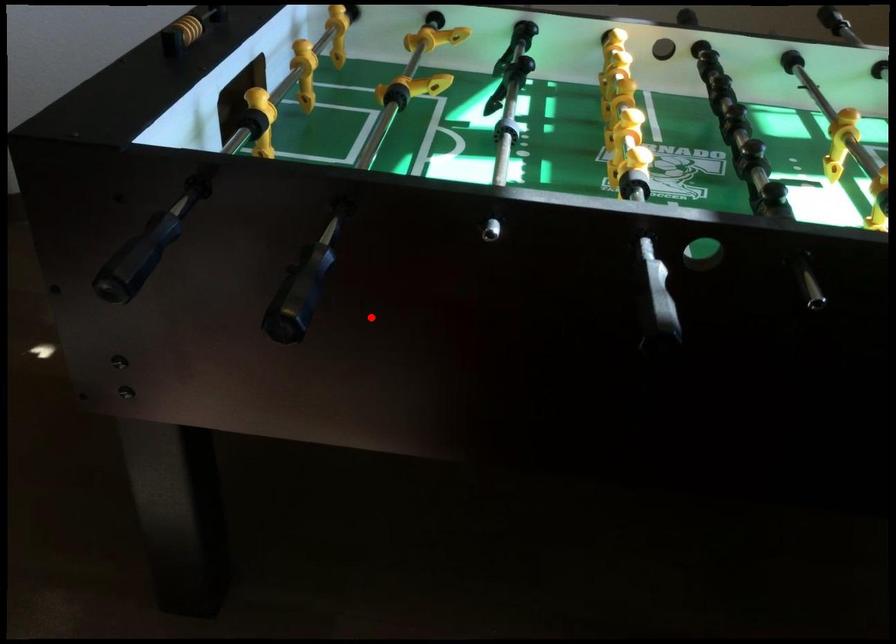
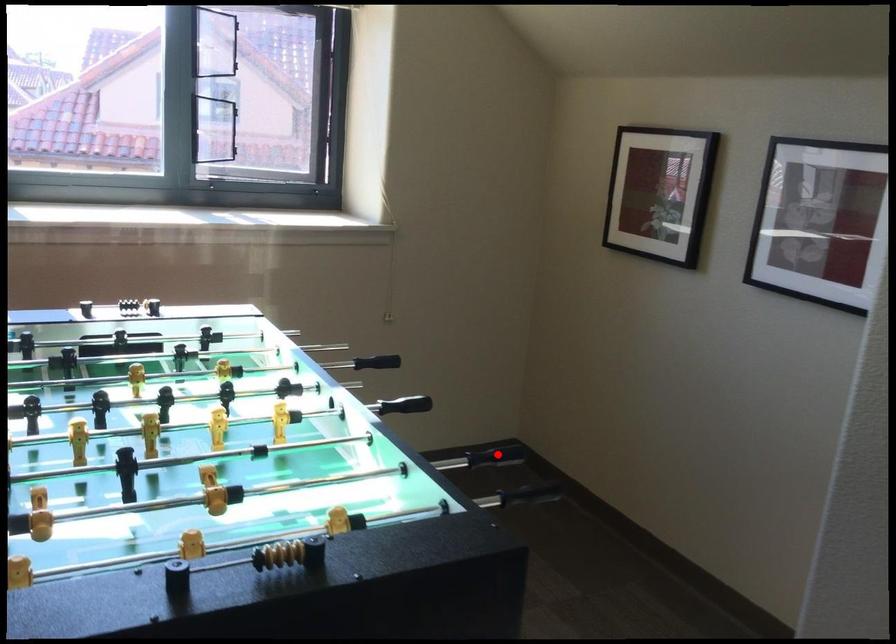
Based on the photo, I am providing you with two images of the same scene from different viewpoints. A red point is marked on the first image and another point is marked on the second image. Is the red point in image1 aligned with the point shown in image2?

Yes